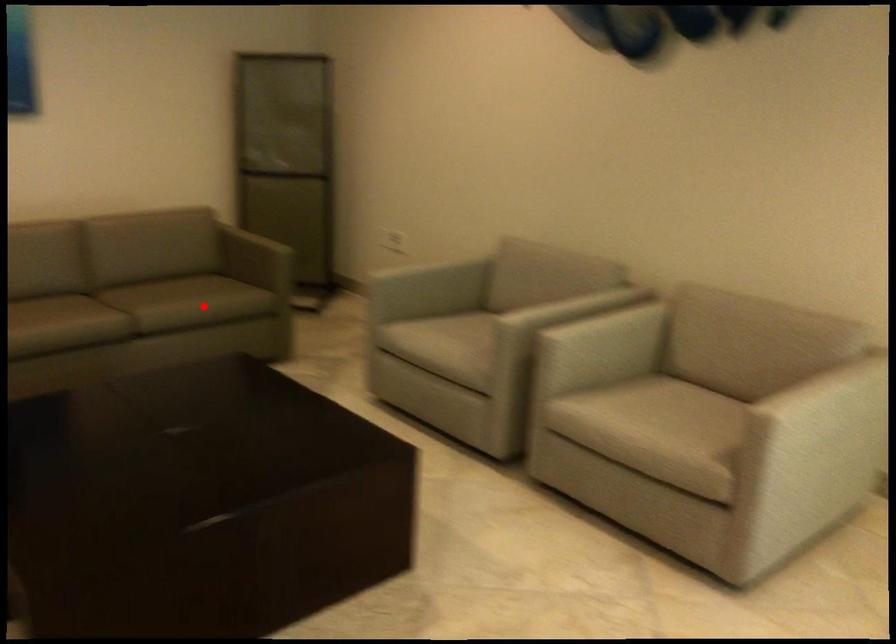
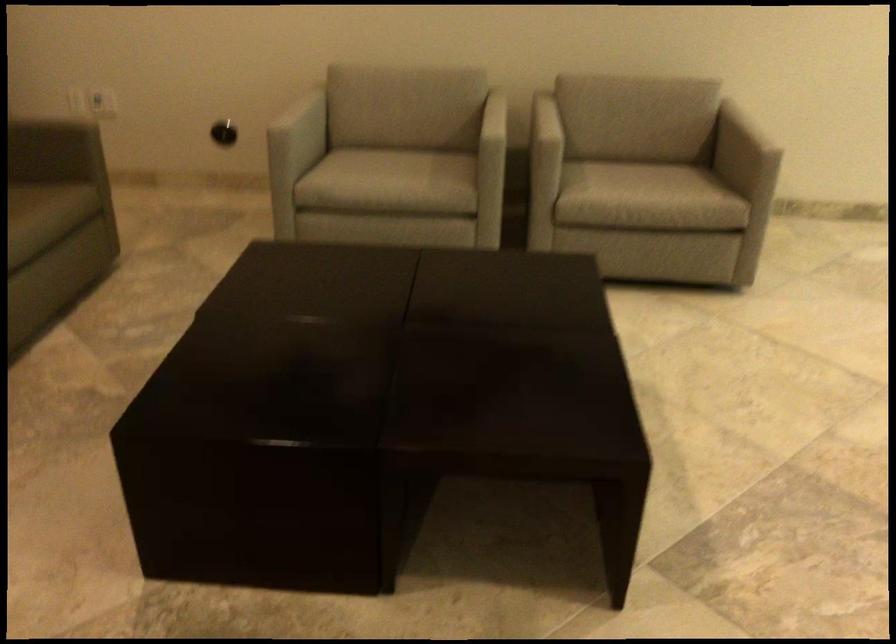
The point at the highlighted location is marked in the first image. Where is the corresponding point in the second image?

(36, 219)